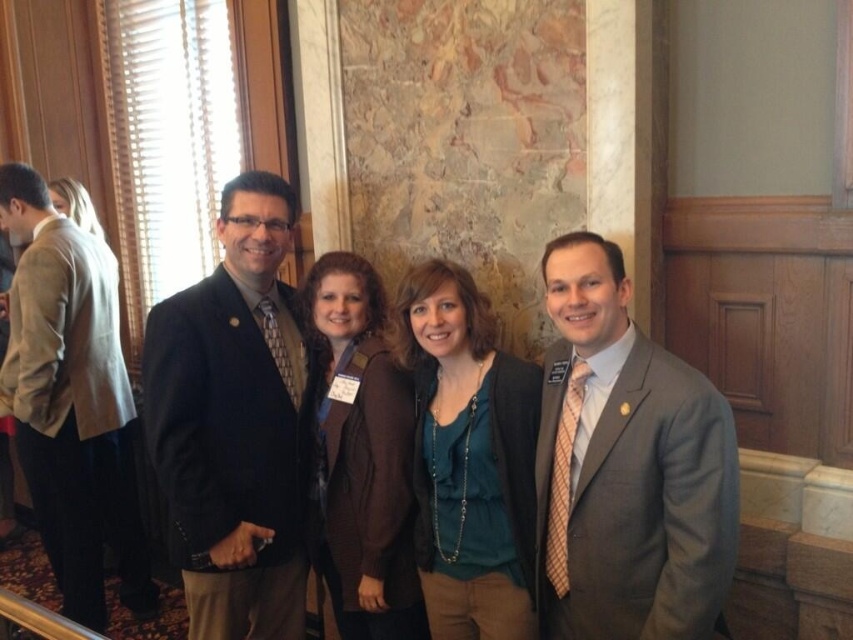
Question: Among these objects, which one is nearest to the camera?

Choices:
 (A) brown leather jacket at center
 (B) gray suit at center

Answer: (B)

Question: Is teal jersey at center positioned before brown leather jacket at center?

Choices:
 (A) no
 (B) yes

Answer: (B)

Question: Which of the following is the closest to the observer?

Choices:
 (A) (297, 380)
 (B) (3, 189)
 (C) (556, 433)
 (D) (450, 572)

Answer: (C)

Question: Is the position of gray suit at center less distant than that of teal jersey at center?

Choices:
 (A) yes
 (B) no

Answer: (A)

Question: Is matte black suit at center thinner than light beige suit at left?

Choices:
 (A) yes
 (B) no

Answer: (A)

Question: Based on their relative distances, which object is farther from the light beige suit at left?

Choices:
 (A) teal jersey at center
 (B) matte black suit at center
 (C) brown leather jacket at center
 (D) gray suit at center

Answer: (D)